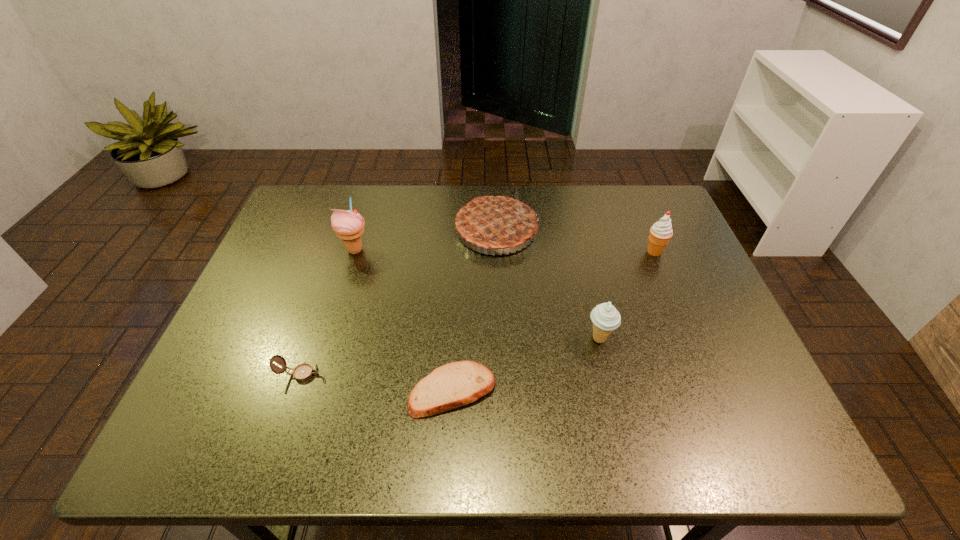
Identify the location of vacant area between the pita bread and the rightmost icecream. (553, 321).

Locate an element on the screen. The image size is (960, 540). free space between the pita bread and the pie is located at coordinates (474, 310).

Identify the location of unoccupied position between the pie and the fifth tallest object. The width and height of the screenshot is (960, 540). (398, 302).

Identify the location of free space between the pie and the pita bread. (474, 310).

At what (x,y) coordinates should I click in order to perform the action: click on unoccupied position between the shortest object and the pie. Please return your answer as a coordinate pair (x, y). The width and height of the screenshot is (960, 540). Looking at the image, I should click on (474, 310).

Identify which object is the closest to the leftmost icecream. Please provide its 2D coordinates. Your answer should be formatted as a tuple, i.e. [(x, y)], where the tuple contains the x and y coordinates of a point satisfying the conditions above.

[(494, 222)]

Where is `object that is the fifth closest to the pita bread`? The image size is (960, 540). object that is the fifth closest to the pita bread is located at coordinates (660, 233).

This screenshot has width=960, height=540. In order to click on icecream that can be found as the second closest to the second shortest object in this screenshot , I will do click(605, 317).

I want to click on the closest icecream to the shortest object, so (605, 317).

This screenshot has width=960, height=540. What are the coordinates of `blank area in the image that satisfies the following two spatial constraints: 1. on the front side of the pie; 2. on the left side of the rightmost icecream` in the screenshot? It's located at (497, 252).